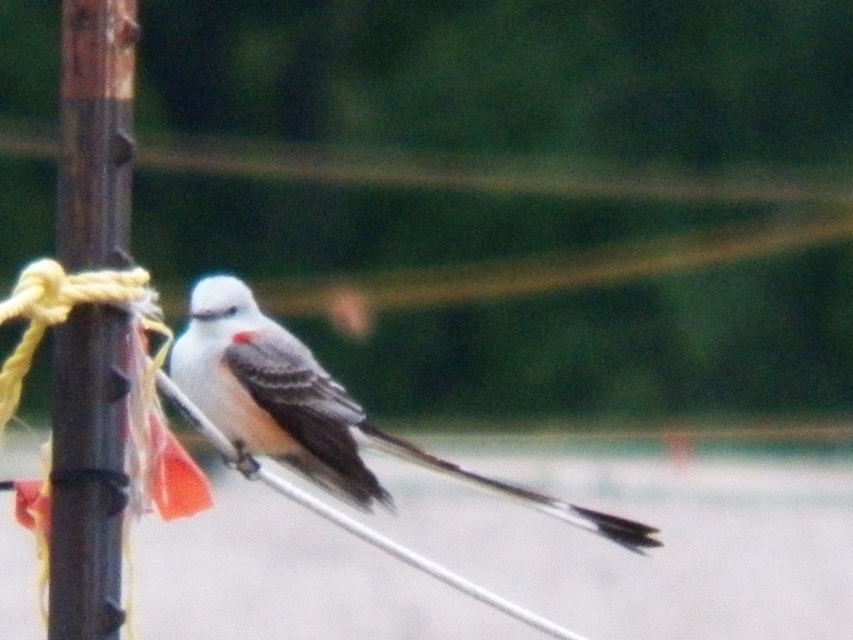
You are a photographer aiming to capture the white matte bird at center without any obstructions. Given that the brown wood pole at left is blocking your view, can you adjust your position to take the photo?

The brown wood pole at left is in front of the white matte bird at center, so moving your position to either side of the pole would allow you to capture the bird without obstruction.

Based on the photo, you are standing in the scene and want to take a photo of the bird. You notice two points in the image labeled as point 1 at coordinates point 1 at coordinates point (x=70, y=32) and point 2 at coordinates point (x=318, y=432). Which point is closer to you?

Point 1 at coordinates point (x=70, y=32) is closer to the camera than point 2 at coordinates point (x=318, y=432).

You are an ornithologist observing the scene. You notice the brown wood pole at left and the white matte bird at center. Which object takes up more visual space in the image?

The white matte bird at center occupies more visual space than the brown wood pole at left, as the pole takes up less space according to the description.